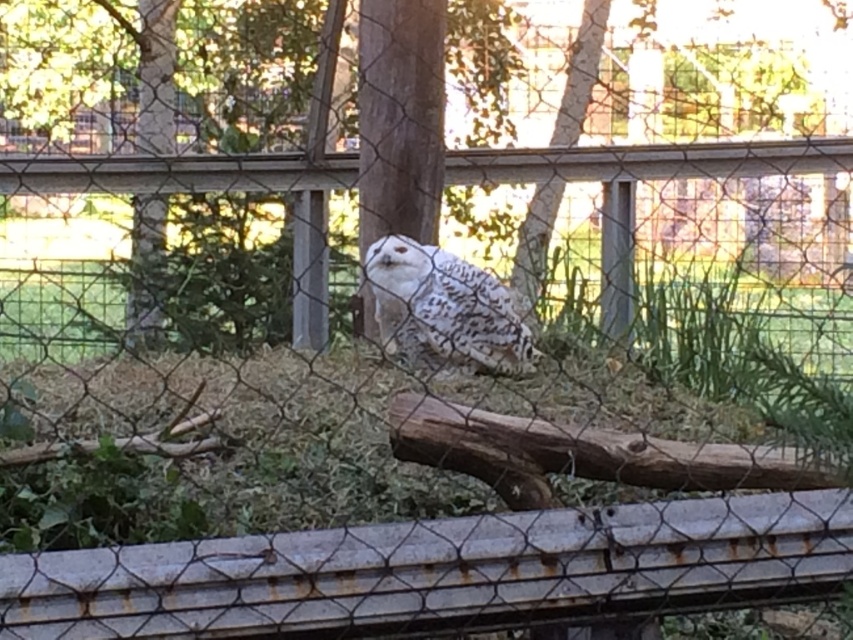
You are a zookeeper trying to clean the enclosure of the snowy owl. You need to reach the rusty metal rail at lower center to secure a new sign. Based on the coordinates provided in the Objects Description, can you determine if the rail is positioned closer to the left or right side of the enclosure?

The rusty metal rail at lower center is located at point (439, 572). Since the x coordinate is 0.894, which is closer to 1 on the horizontal axis, the rail is positioned closer to the right side of the enclosure.

You are a zookeeper trying to determine if the white speckled owl at center can see over the rusty metal rail at lower center. Based on their heights, can the owl see over the rail?

The rusty metal rail at lower center has a lesser height compared to white speckled owl at center, so the owl can see over the rail.

Looking at this image, you are standing in front of the zoo enclosure looking at the snowy owl on the log. There are two points marked in the image. Which point is closer to you, point [590,568] or point [512,310]?

Point [590,568] is in front of point [512,310], so it is closer to you.